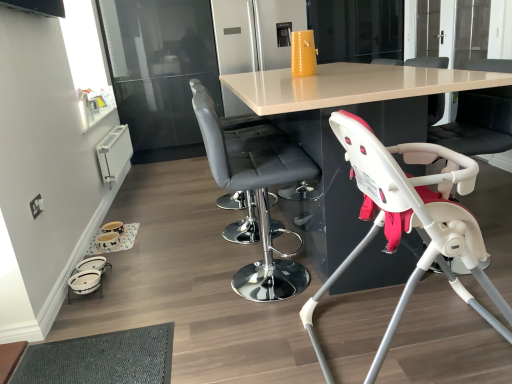
The height and width of the screenshot is (384, 512). In order to click on unoccupied area in front of matte gray bar stool at center, placed as the second chair when sorted from front to back in this screenshot , I will do `click(254, 336)`.